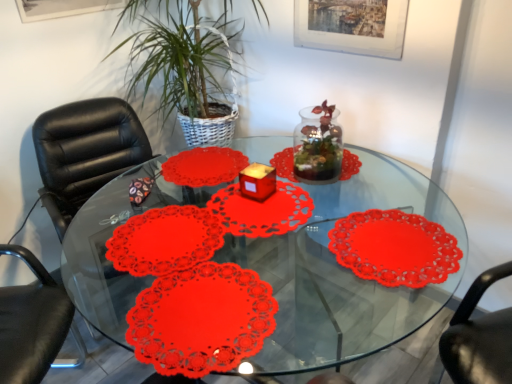
Question: Should I look upward or downward to see matte paper doily at center?

Choices:
 (A) down
 (B) up

Answer: (A)

Question: Is matte paper doily at center at the back of transparent glass jar at center?

Choices:
 (A) no
 (B) yes

Answer: (A)

Question: Considering the relative positions of transparent glass jar at center and matte paper doily at center in the image provided, is transparent glass jar at center to the left of matte paper doily at center from the viewer's perspective?

Choices:
 (A) no
 (B) yes

Answer: (A)

Question: Considering the relative positions of transparent glass jar at center and matte paper doily at center in the image provided, is transparent glass jar at center to the right of matte paper doily at center from the viewer's perspective?

Choices:
 (A) yes
 (B) no

Answer: (A)

Question: Does transparent glass jar at center have a greater width compared to matte paper doily at center?

Choices:
 (A) no
 (B) yes

Answer: (A)

Question: From the image's perspective, is transparent glass jar at center on matte paper doily at center?

Choices:
 (A) yes
 (B) no

Answer: (A)

Question: Can you confirm if transparent glass jar at center is bigger than matte paper doily at center?

Choices:
 (A) no
 (B) yes

Answer: (B)

Question: Does matte red candle holder at center have a lesser height compared to matte paper doily at center?

Choices:
 (A) no
 (B) yes

Answer: (A)

Question: From the image's perspective, is matte red candle holder at center located beneath matte paper doily at center?

Choices:
 (A) no
 (B) yes

Answer: (A)

Question: Does matte red candle holder at center have a greater width compared to matte paper doily at center?

Choices:
 (A) no
 (B) yes

Answer: (A)

Question: Is there a large distance between matte red candle holder at center and matte paper doily at center?

Choices:
 (A) no
 (B) yes

Answer: (A)

Question: Does matte red candle holder at center have a smaller size compared to matte paper doily at center?

Choices:
 (A) no
 (B) yes

Answer: (B)

Question: Does matte red candle holder at center appear on the right side of matte paper doily at center?

Choices:
 (A) no
 (B) yes

Answer: (B)

Question: From a real-world perspective, is green leafy plant at center over transparent plastic placemats at center?

Choices:
 (A) no
 (B) yes

Answer: (B)